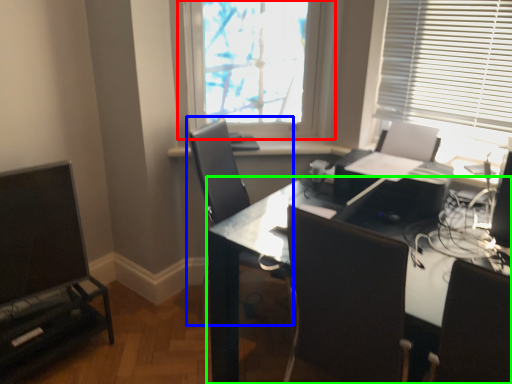
Question: Which is farther away from window (highlighted by a red box)? chair (highlighted by a blue box) or desk (highlighted by a green box)?

Choices:
 (A) chair
 (B) desk

Answer: (B)